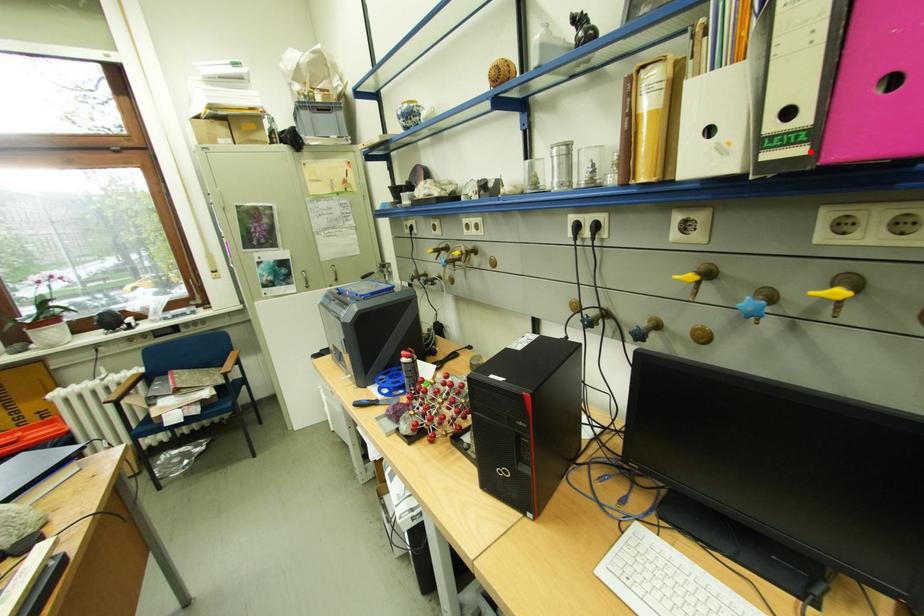
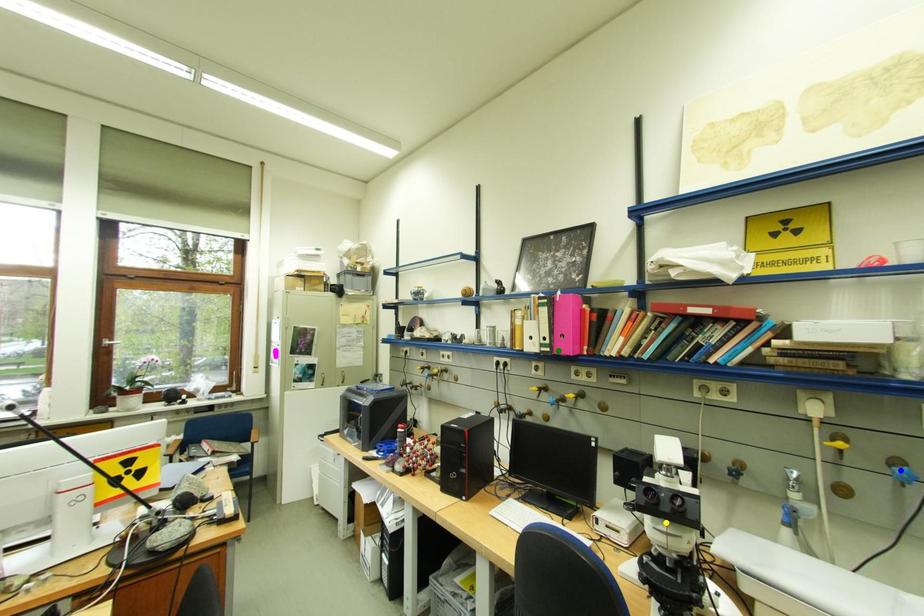
Question: I am providing you with two images of the same scene from different viewpoints. A red point is marked on the first image. You are given multiple points on the second image. Which point in image 2 is actually the same real-world point as the red point in image 1?

Choices:
 (A) blue point
 (B) yellow point
 (C) green point

Answer: (C)